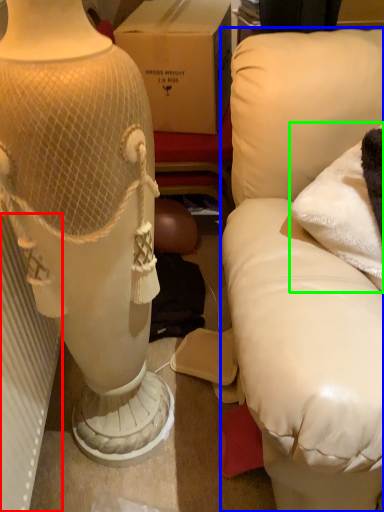
Question: Based on their relative distances, which object is farther from radiator (highlighted by a red box)? Choose from furniture (highlighted by a blue box) and pillow (highlighted by a green box).

Choices:
 (A) furniture
 (B) pillow

Answer: (B)